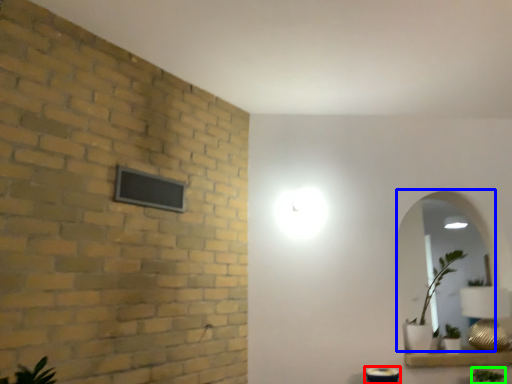
Question: Which is farther away from table (highlighted by a red box)? mirror (highlighted by a blue box) or plant (highlighted by a green box)?

Choices:
 (A) mirror
 (B) plant

Answer: (A)